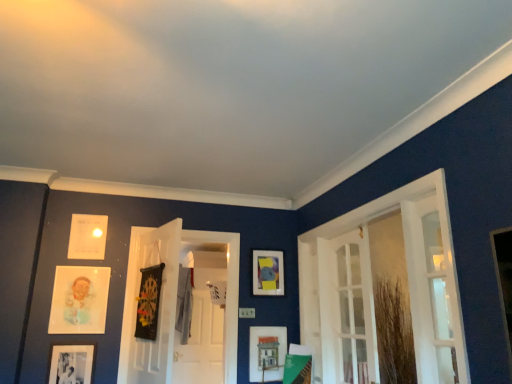
Question: In terms of height, does matte wooden picture frame at lower center, arranged as the sixth picture frame when viewed from the left, look taller or shorter compared to black glossy dartboard at center, which is the first door in left-to-right order?

Choices:
 (A) tall
 (B) short

Answer: (B)

Question: Is matte wooden picture frame at lower center, arranged as the sixth picture frame when viewed from the left, to the left or to the right of black glossy dartboard at center, which is the 3th door in right-to-left order, in the image?

Choices:
 (A) right
 (B) left

Answer: (A)

Question: Which object is the farthest from the matte wooden picture frame at lower center, arranged as the sixth picture frame when viewed from the left?

Choices:
 (A) white glass door at right, the second door when ordered from right to left
 (B) white glass door at right, which is the third door in left-to-right order
 (C) white paper at upper left, the 4th picture frame in the right-to-left sequence
 (D) white glass door at right
 (E) matte paper portrait at left, the second picture frame viewed from the left

Answer: (B)

Question: Which of these objects is positioned closest to the white glass door at right, the second door when ordered from right to left?

Choices:
 (A) white glass door at right, which is the third door in left-to-right order
 (B) white glass door at right
 (C) matte wooden picture frame at lower center, arranged as the sixth picture frame when viewed from the left
 (D) white glossy door at center
 (E) matte paper portrait at left, the second picture frame viewed from the left

Answer: (B)